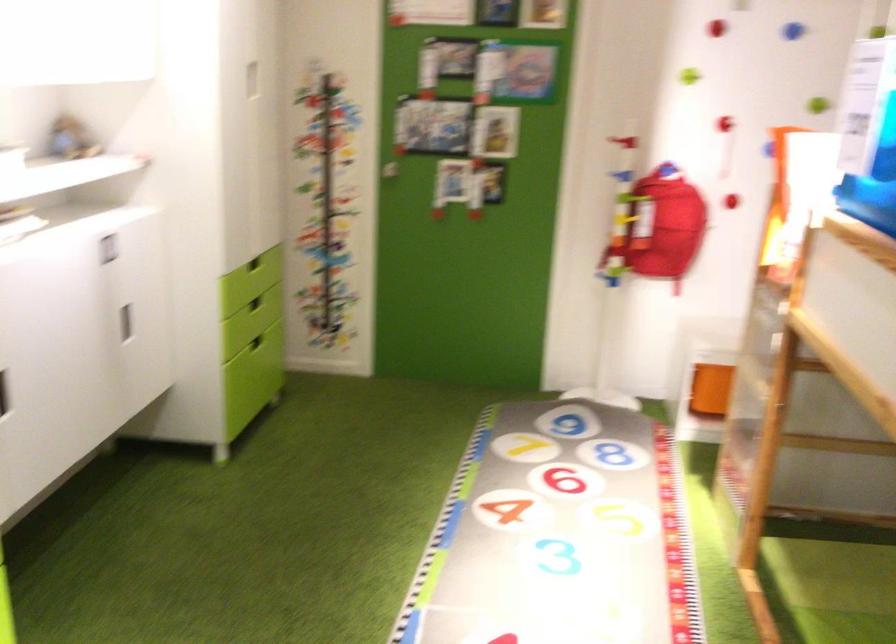
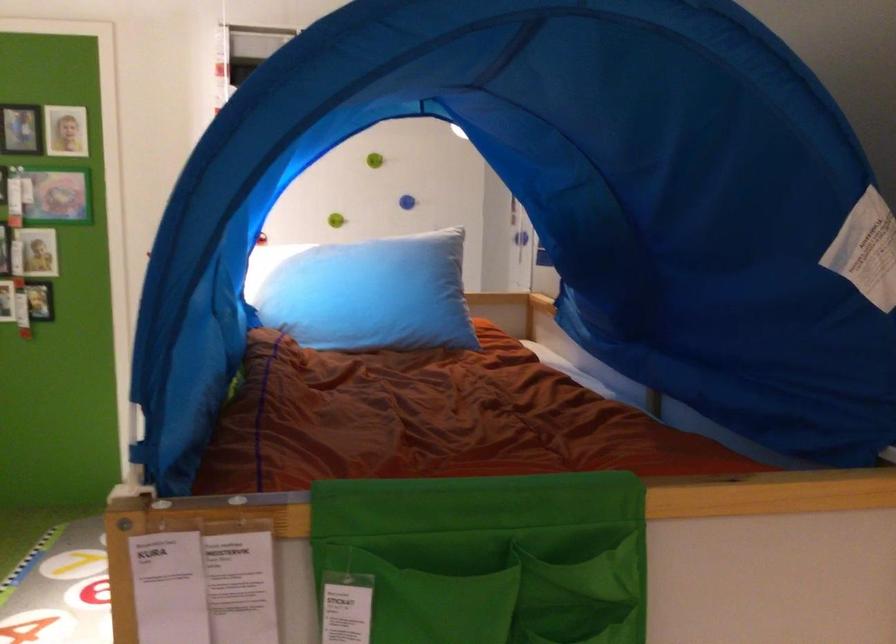
What movement of the cameraman would produce the second image?

The cameraman moved toward right, backward.